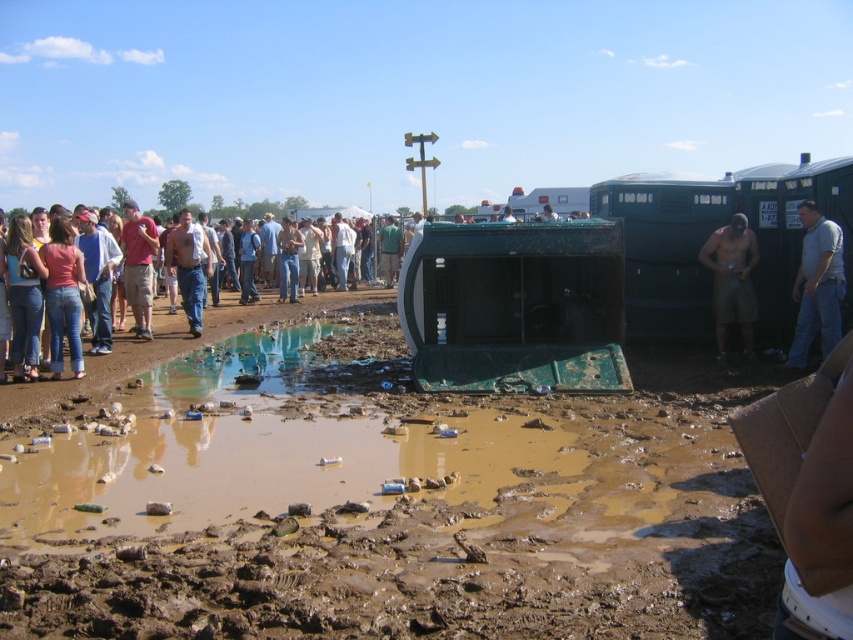
Where is `muddy water at center`? muddy water at center is located at coordinates (241, 364).

The image size is (853, 640). Identify the location of muddy water at center. (241, 364).

In order to click on muddy water at center in this screenshot , I will do `click(241, 364)`.

Is point (115, 368) in front of point (755, 304)?

That is True.

Locate an element on the screen. denim jeans at center is located at coordinates (209, 332).

Does muddy brown dirt at center appear over tan shorts at right?

No.

Is muddy brown dirt at center taller than tan shorts at right?

No, muddy brown dirt at center is not taller than tan shorts at right.

Who is more distant from viewer, (479, 540) or (743, 275)?

The point (743, 275) is more distant.

Locate an element on the screen. The height and width of the screenshot is (640, 853). muddy brown dirt at center is located at coordinates (380, 509).